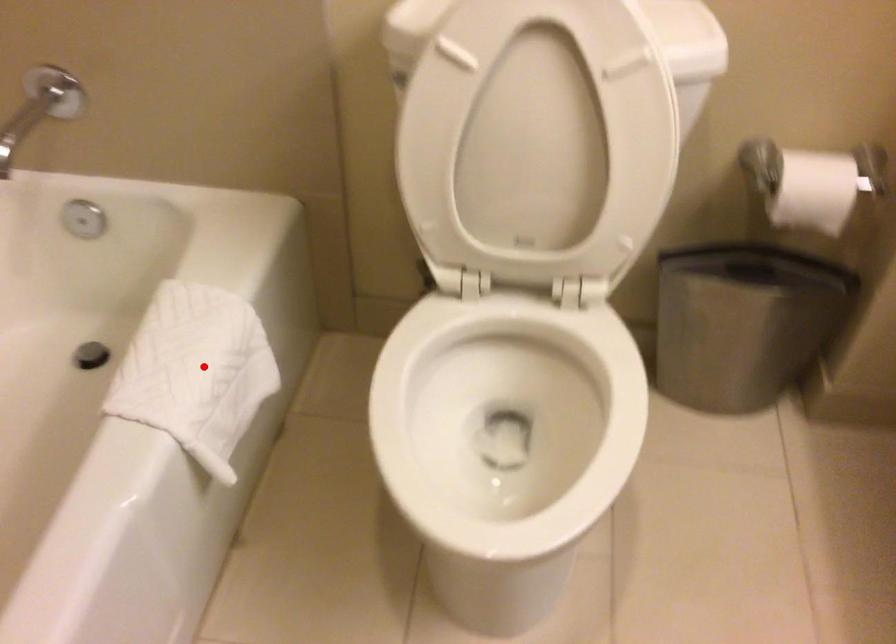
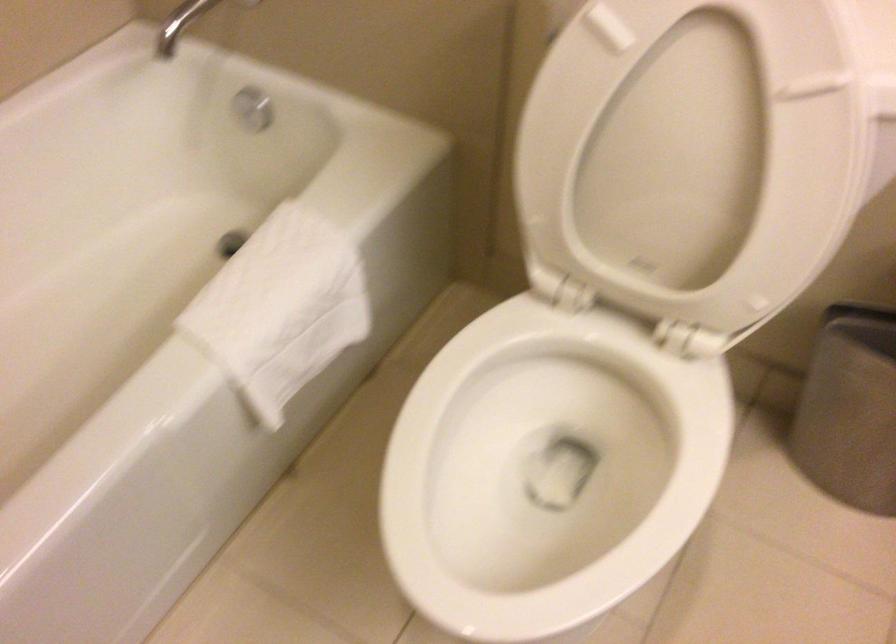
In the second image, find the point that corresponds to the highlighted location in the first image.

(282, 303)